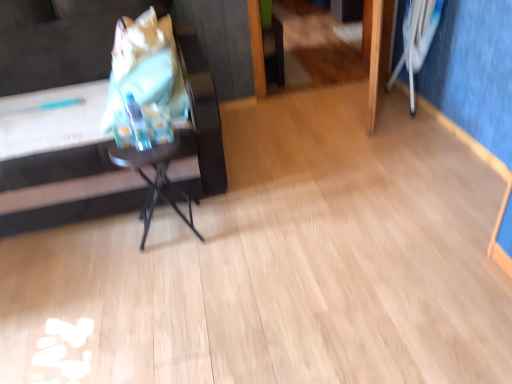
Image resolution: width=512 pixels, height=384 pixels. In order to click on white fabric swivel chair at upper right in this screenshot , I will do `click(417, 39)`.

Is matte plastic grocery bag at left positioned with its back to matte black side table at left?

Absolutely, matte plastic grocery bag at left is directed away from matte black side table at left.

Can you confirm if matte plastic grocery bag at left is positioned to the right of matte black side table at left?

Yes, matte plastic grocery bag at left is to the right of matte black side table at left.

Can you confirm if matte plastic grocery bag at left is shorter than matte black side table at left?

Yes.

Looking at the image, does white fabric swivel chair at upper right seem bigger or smaller compared to metallic black table at center?

In the image, white fabric swivel chair at upper right appears to be larger than metallic black table at center.

Visually, is white fabric swivel chair at upper right positioned to the left or to the right of metallic black table at center?

white fabric swivel chair at upper right is positioned on metallic black table at center's right side.

Is the depth of white fabric swivel chair at upper right greater than that of metallic black table at center?

That is True.

Find the location of a particular element. table that is on the right side of matte plastic grocery bag at left is located at coordinates [x=154, y=179].

Which is nearer, (162, 168) or (144, 79)?

Point (162, 168)

Can you tell me how much metallic black table at center and matte plastic grocery bag at left differ in facing direction?

metallic black table at center and matte plastic grocery bag at left are facing 91.1 degrees away from each other.

From a real-world perspective, does metallic black table at center stand above matte plastic grocery bag at left?

No, from a real-world perspective, metallic black table at center is not over matte plastic grocery bag at left

Considering the relative sizes of metallic black table at center and matte black side table at left in the image provided, is metallic black table at center shorter than matte black side table at left?

Yes, metallic black table at center is shorter than matte black side table at left.

The width and height of the screenshot is (512, 384). In order to click on furniture above the metallic black table at center (from a real-world perspective) in this screenshot , I will do `click(59, 127)`.

Looking at this image, from the image's perspective, is metallic black table at center located above matte black side table at left?

Incorrect, from the image's perspective, metallic black table at center is lower than matte black side table at left.

From a real-world perspective, which object stands above the other?

In real-world perspective, white fabric swivel chair at upper right is above.

Is metallic black table at center located outside white fabric swivel chair at upper right?

Yes.

In the scene shown: Considering the sizes of metallic black table at center and white fabric swivel chair at upper right in the image, is metallic black table at center taller or shorter than white fabric swivel chair at upper right?

Considering their sizes, metallic black table at center has less height than white fabric swivel chair at upper right.

Considering the sizes of metallic black table at center and white fabric swivel chair at upper right in the image, is metallic black table at center wider or thinner than white fabric swivel chair at upper right?

metallic black table at center is wider than white fabric swivel chair at upper right.

The height and width of the screenshot is (384, 512). In order to click on grocery bag on the left of metallic black table at center in this screenshot , I will do `click(145, 69)`.

Which of these two, matte plastic grocery bag at left or metallic black table at center, is thinner?

With smaller width is metallic black table at center.

Between point (118, 29) and point (144, 242), which one is positioned in front?

The point (144, 242) is more forward.

Based on the photo, considering the sizes of matte plastic grocery bag at left and metallic black table at center in the image, is matte plastic grocery bag at left bigger or smaller than metallic black table at center?

Clearly, matte plastic grocery bag at left is larger in size than metallic black table at center.

From the image's perspective, is matte black side table at left under white fabric swivel chair at upper right?

Yes.

Between matte black side table at left and white fabric swivel chair at upper right, which one has smaller size?

white fabric swivel chair at upper right.

Which is more to the left, matte black side table at left or white fabric swivel chair at upper right?

matte black side table at left is more to the left.

Which is correct: matte black side table at left is inside white fabric swivel chair at upper right, or outside of it?

matte black side table at left exists outside the volume of white fabric swivel chair at upper right.

I want to click on furniture beneath the matte plastic grocery bag at left (from a real-world perspective), so click(59, 127).

Identify the location of table on the left of white fabric swivel chair at upper right. The height and width of the screenshot is (384, 512). (154, 179).

When comparing their distances from metallic black table at center, does matte black side table at left or matte plastic grocery bag at left seem closer?

matte black side table at left is positioned closer to the anchor metallic black table at center.

Based on their spatial positions, is white fabric swivel chair at upper right or matte black side table at left closer to matte plastic grocery bag at left?

matte black side table at left lies closer to matte plastic grocery bag at left than the other object.

From the image, which object appears to be nearer to white fabric swivel chair at upper right, matte plastic grocery bag at left or metallic black table at center?

The object closer to white fabric swivel chair at upper right is matte plastic grocery bag at left.

Estimate the real-world distances between objects in this image. Which object is closer to metallic black table at center, white fabric swivel chair at upper right or matte black side table at left?

matte black side table at left is closer to metallic black table at center.

From the picture: Considering their positions, is white fabric swivel chair at upper right positioned closer to matte black side table at left than metallic black table at center?

metallic black table at center lies closer to matte black side table at left than the other object.

From the image, which object appears to be nearer to matte black side table at left, metallic black table at center or white fabric swivel chair at upper right?

The object closer to matte black side table at left is metallic black table at center.

From the picture: Looking at the image, which one is located closer to metallic black table at center, matte plastic grocery bag at left or matte black side table at left?

Among the two, matte black side table at left is located nearer to metallic black table at center.

When comparing their distances from matte black side table at left, does matte plastic grocery bag at left or metallic black table at center seem further?

Based on the image, metallic black table at center appears to be further to matte black side table at left.

Find the location of a particular element. The height and width of the screenshot is (384, 512). table between matte black side table at left and white fabric swivel chair at upper right in the horizontal direction is located at coordinates (154, 179).

Locate an element on the screen. This screenshot has height=384, width=512. table between matte plastic grocery bag at left and white fabric swivel chair at upper right is located at coordinates (154, 179).

Image resolution: width=512 pixels, height=384 pixels. What are the coordinates of `furniture between matte plastic grocery bag at left and metallic black table at center in the up-down direction` in the screenshot? It's located at (59, 127).

Locate an element on the screen. grocery bag between matte black side table at left and white fabric swivel chair at upper right from left to right is located at coordinates tap(145, 69).